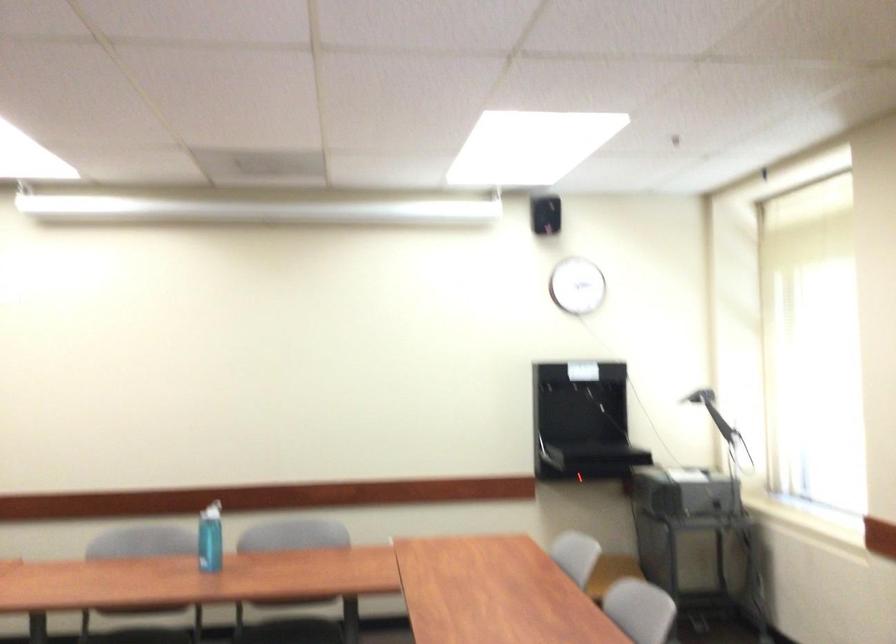
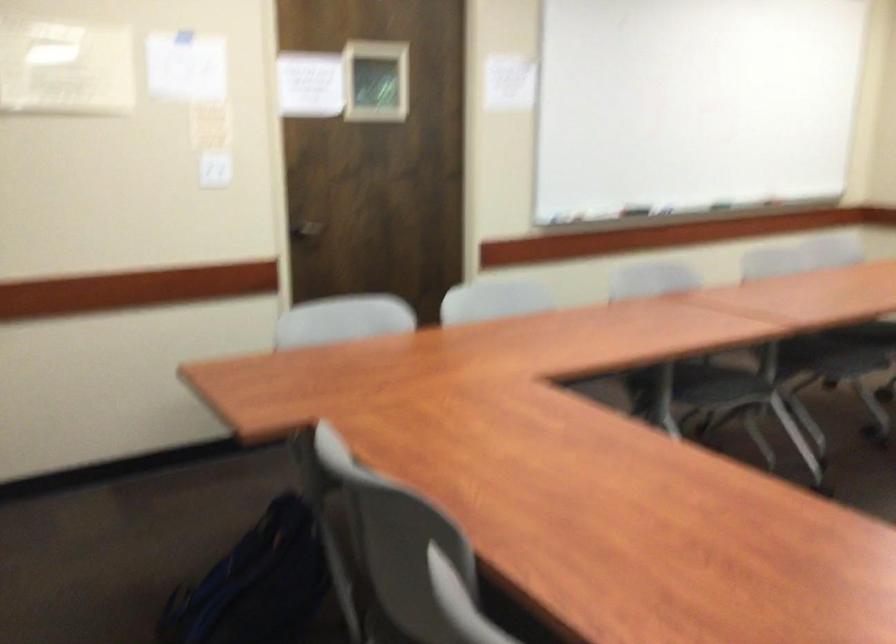
The images are taken continuously from a first-person perspective. In which direction is your viewpoint rotating?

The camera rotated toward left-down.